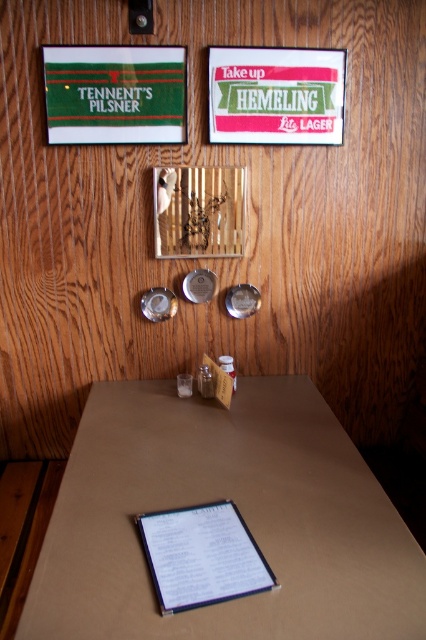
Which of these two, green fabric signboard at upper left or white paper clipboard at center, stands shorter?

With less height is white paper clipboard at center.

Between green fabric signboard at upper left and white paper clipboard at center, which one is positioned higher?

green fabric signboard at upper left is above.

Between point (178, 88) and point (169, 557), which one is positioned behind?

Positioned behind is point (178, 88).

This screenshot has width=426, height=640. What are the coordinates of `green fabric signboard at upper left` in the screenshot? It's located at (115, 93).

Does brown cardboard table at center have a greater width compared to green fabric signboard at upper left?

Indeed, brown cardboard table at center has a greater width compared to green fabric signboard at upper left.

Between point (146, 636) and point (120, 122), which one is positioned behind?

The point (120, 122) is more distant.

Between point (264, 531) and point (109, 138), which one is positioned in front?

Point (264, 531)

Locate an element on the screen. This screenshot has height=640, width=426. brown cardboard table at center is located at coordinates (238, 509).

Describe the element at coordinates (238, 509) in the screenshot. I see `brown cardboard table at center` at that location.

Can you confirm if brown cardboard table at center is wider than white paper clipboard at center?

Indeed, brown cardboard table at center has a greater width compared to white paper clipboard at center.

Where is `brown cardboard table at center`? Image resolution: width=426 pixels, height=640 pixels. brown cardboard table at center is located at coordinates (238, 509).